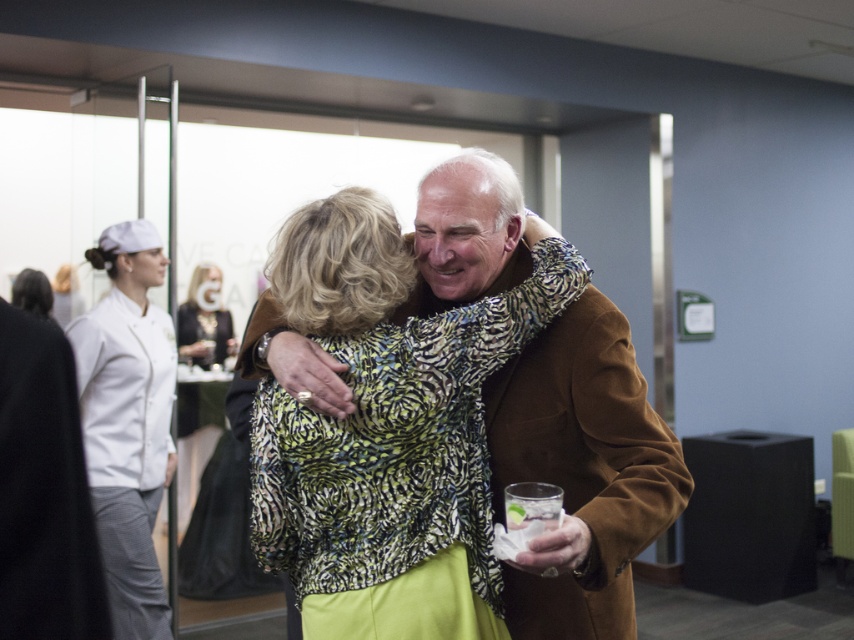
Which of these two, brown wool coat at center or white chef's uniform at left, stands taller?

With more height is white chef's uniform at left.

Which is below, brown wool coat at center or white chef's uniform at left?

white chef's uniform at left

The width and height of the screenshot is (854, 640). I want to click on brown wool coat at center, so click(x=581, y=470).

Where is `brown wool coat at center`? The height and width of the screenshot is (640, 854). brown wool coat at center is located at coordinates (581, 470).

Which is above, white chef's uniform at left or black satin dress at center?

black satin dress at center is above.

Does white chef's uniform at left have a greater width compared to black satin dress at center?

Correct, the width of white chef's uniform at left exceeds that of black satin dress at center.

Between point (95, 468) and point (186, 298), which one is positioned in front?

Positioned in front is point (95, 468).

At what (x,y) coordinates should I click in order to perform the action: click on white chef's uniform at left. Please return your answer as a coordinate pair (x, y). The image size is (854, 640). Looking at the image, I should click on (127, 420).

Is point (446, 273) closer to viewer compared to point (185, 323)?

Yes, point (446, 273) is closer to viewer.

Can you confirm if brown wool coat at center is positioned to the right of black satin dress at center?

Indeed, brown wool coat at center is positioned on the right side of black satin dress at center.

This screenshot has height=640, width=854. Identify the location of brown wool coat at center. (581, 470).